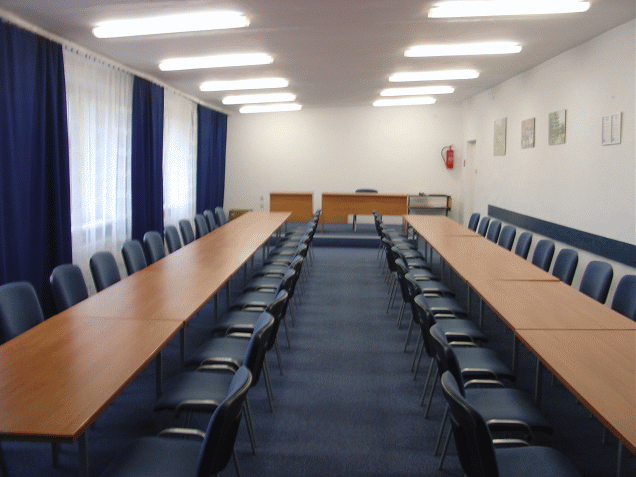
The height and width of the screenshot is (477, 636). I want to click on label on extinguisher, so click(452, 159).